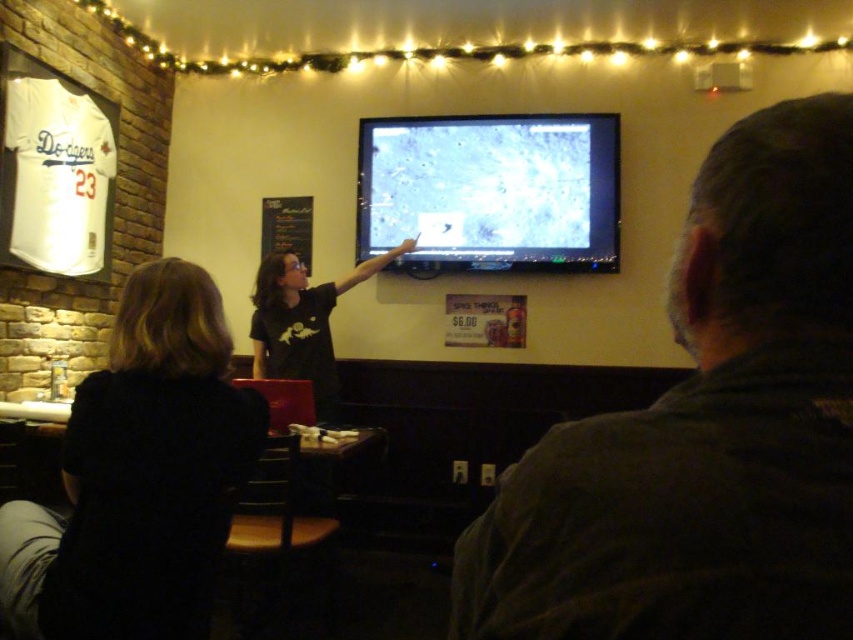
Who is positioned more to the right, dark brown leather jacket at upper right or matte plastic screen at center?

matte plastic screen at center

Who is taller, dark brown leather jacket at upper right or matte plastic screen at center?

Standing taller between the two is matte plastic screen at center.

Who is more forward, (692,216) or (469,253)?

Point (692,216) is more forward.

You are a GUI agent. You are given a task and a screenshot of the screen. Output one action in this format:
    pyautogui.click(x=<x>, y=<y>)
    Task: Click on the dark brown leather jacket at upper right
    This screenshot has height=640, width=853.
    Given the screenshot: What is the action you would take?
    click(x=705, y=429)

Looking at this image, measure the distance between dark brown leather jacket at upper right and black fabric shirt at lower left.

A distance of 4.11 feet exists between dark brown leather jacket at upper right and black fabric shirt at lower left.

Does dark brown leather jacket at upper right have a greater height compared to black fabric shirt at lower left?

Incorrect, dark brown leather jacket at upper right's height is not larger of black fabric shirt at lower left's.

What do you see at coordinates (705, 429) in the screenshot?
I see `dark brown leather jacket at upper right` at bounding box center [705, 429].

The height and width of the screenshot is (640, 853). I want to click on dark brown leather jacket at upper right, so click(705, 429).

Who is higher up, black fabric shirt at lower left or matte plastic screen at center?

matte plastic screen at center is higher up.

Which is behind, point (125, 460) or point (474, 250)?

The point (474, 250) is more distant.

The width and height of the screenshot is (853, 640). What are the coordinates of `black fabric shirt at lower left` in the screenshot? It's located at (138, 476).